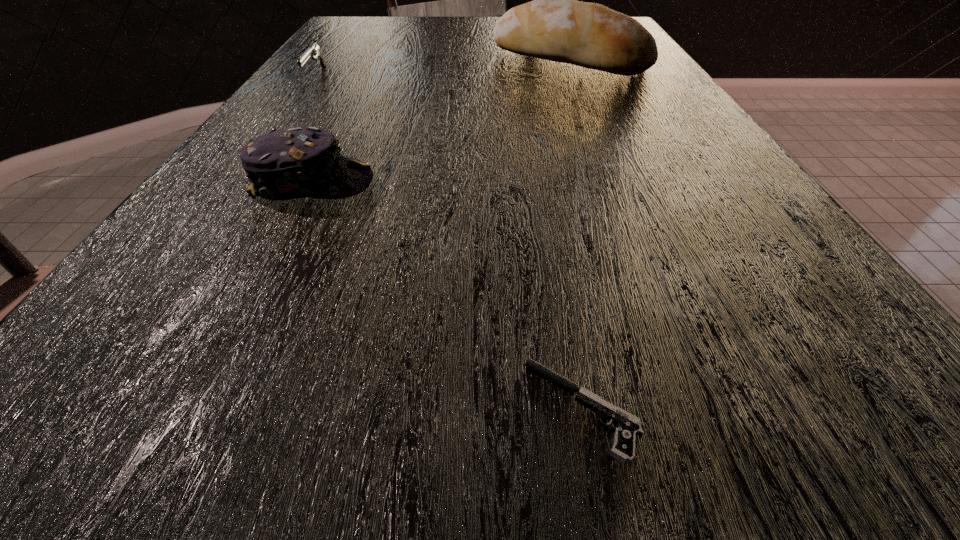
Identify the location of the farthest pistol. (526, 0).

Find the location of `the tallest pistol`. the tallest pistol is located at coordinates (526, 0).

Image resolution: width=960 pixels, height=540 pixels. Find the location of `bread`. bread is located at coordinates (554, 26).

Locate an element on the screen. The image size is (960, 540). the second nearest object is located at coordinates (297, 162).

Find the location of `the second object from left to right`. the second object from left to right is located at coordinates (297, 162).

Locate an element on the screen. The height and width of the screenshot is (540, 960). the fourth tallest object is located at coordinates (314, 50).

I want to click on the second nearest pistol, so click(x=314, y=50).

Identify the location of the shortest pistol. The height and width of the screenshot is (540, 960). (628, 426).

Find the location of `the nearest object`. the nearest object is located at coordinates (628, 426).

I want to click on blank space located at the barrel of the farthest pistol, so click(406, 19).